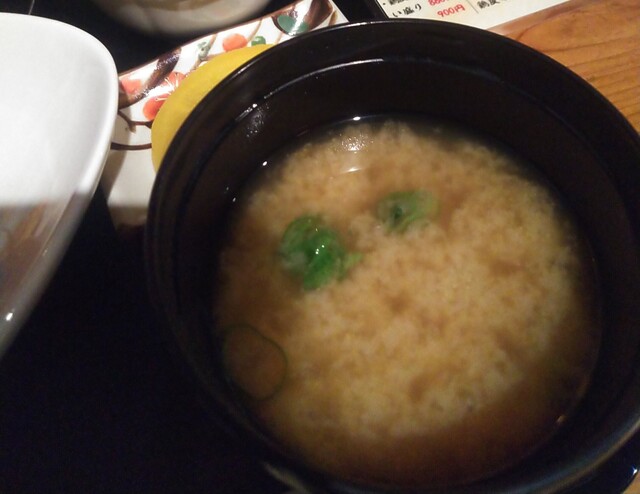
At what (x,y) coordinates should I click in order to perform the action: click on rim of black bowl. Please return your answer as a coordinate pair (x, y). The height and width of the screenshot is (494, 640). Looking at the image, I should click on (185, 121), (486, 29), (628, 119), (596, 470), (260, 460).